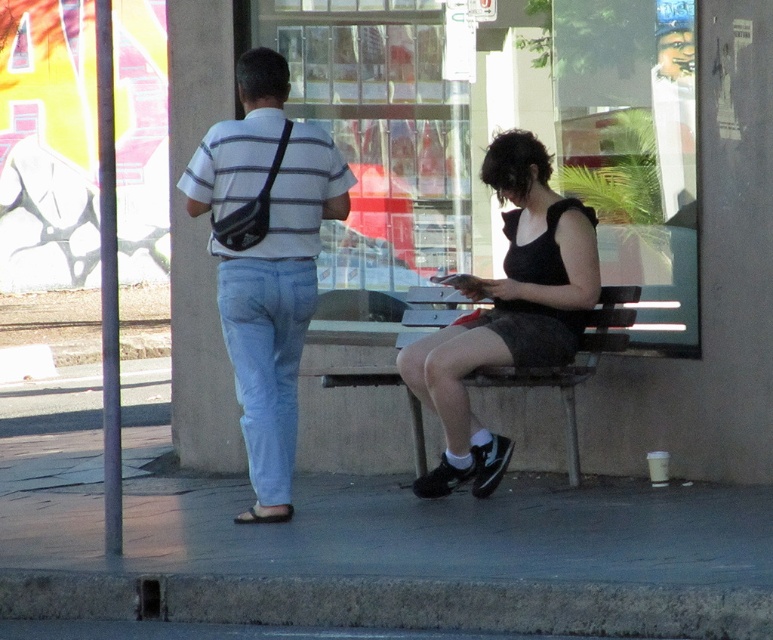
Question: Which object appears farthest from the camera in this image?

Choices:
 (A) matte black sneakers at lower center
 (B) wooden bench at center

Answer: (B)

Question: Which object is closer to the camera taking this photo?

Choices:
 (A) wooden bench at center
 (B) black fabric dress at center
 (C) matte black sneakers at lower center

Answer: (B)

Question: Does matte black sneakers at lower center appear under light blue denim jeans at center?

Choices:
 (A) yes
 (B) no

Answer: (B)

Question: Is matte black sneakers at lower center in front of striped cotton shirt at center?

Choices:
 (A) yes
 (B) no

Answer: (B)

Question: Among these points, which one is farthest from the camera?

Choices:
 (A) (240, 67)
 (B) (628, 291)
 (C) (298, 369)
 (D) (523, 188)

Answer: (B)

Question: Can you confirm if striped cotton shirt at center is smaller than black fabric dress at center?

Choices:
 (A) yes
 (B) no

Answer: (A)